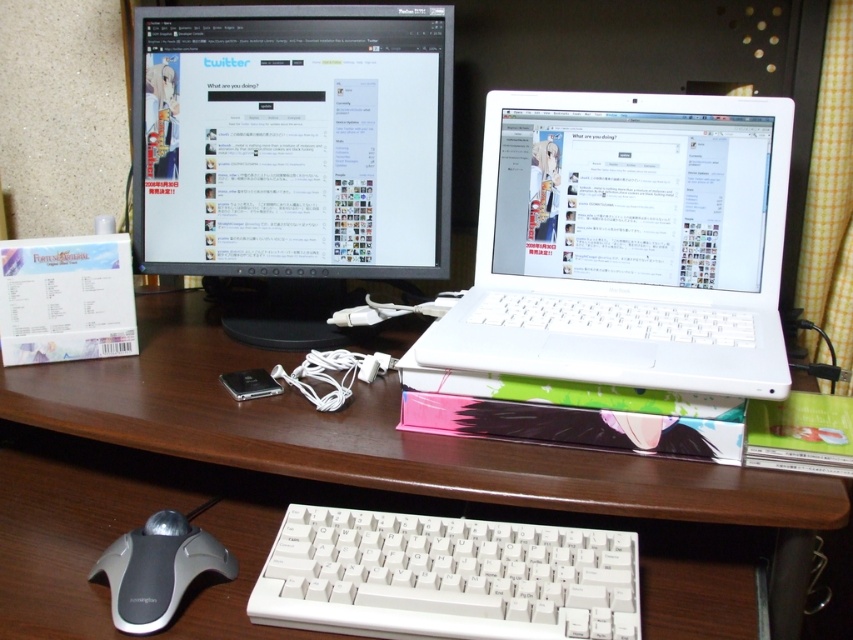
You are a remote worker who needs to place a new wireless charger on your desk. The charger has a circular base with a diameter of 10 cm. You want to place it between the two points labeled as point (x=538, y=154) and point (x=67, y=388). Can you fit the charger between them without it overlapping either point?

Point (x=538, y=154) is behind point (x=67, y=388). Since the charger has a diameter of 10 cm, it requires a space of at least 10 cm between the two points to fit without overlapping. However, the distance between the two points is not provided, so we cannot confirm if it will fit. Please measure the distance between the points first.

You are setting up a new desk and want to place a wireless charger exactly at the center of the desk. The desk has a coordinate system where the bottom left corner is the origin. Given the position of the white plastic keyboard at center at point 0.903, 0.524, can you determine if the wireless charger will be placed to the left or right of the keyboard?

The white plastic keyboard at center is located at point (445, 577). Since the coordinate system has the bottom left corner as the origin, the x and y values increase to the right and upwards respectively. The center of the desk would be at coordinates (426, 320). The keyboard is positioned at 0.903 on the x axis which is to the right of the center. Therefore, placing the wireless charger at the desk center would position it to the left of the white plastic keyboard at center.

You are organizing your desk and want to place a new wireless charger between the white plastic laptop at center and the white wood computer desk at center. Based on their positions, where should you place the charger?

The white plastic laptop at center is located above the white wood computer desk at center, so the wireless charger should be placed on the desk below the laptop to ensure proper placement.